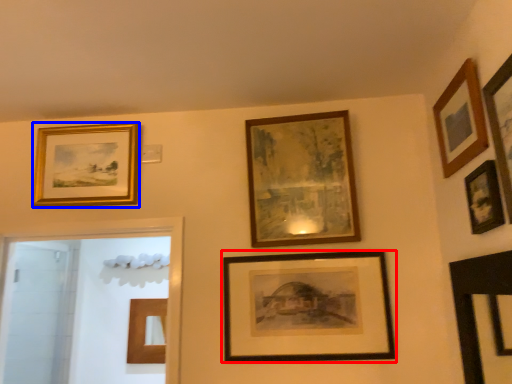
Question: Which of the following is the closest to the observer, picture frame (highlighted by a red box) or picture frame (highlighted by a blue box)?

Choices:
 (A) picture frame
 (B) picture frame

Answer: (A)